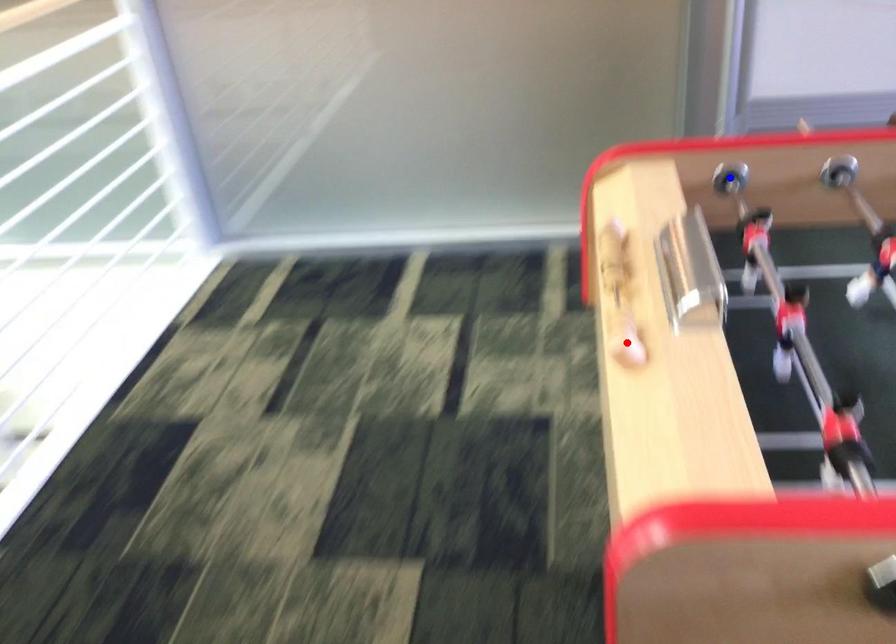
Question: Two points are marked on the image. Which point is closer to the camera?

Choices:
 (A) Blue point is closer.
 (B) Red point is closer.

Answer: (B)